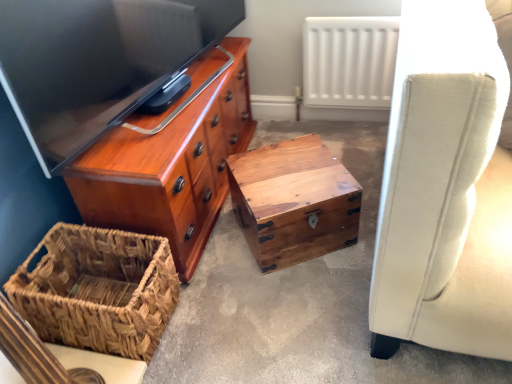
Locate an element on the screen. Image resolution: width=512 pixels, height=384 pixels. vacant space in front of shiny wood chest of drawers at upper left is located at coordinates pos(261,300).